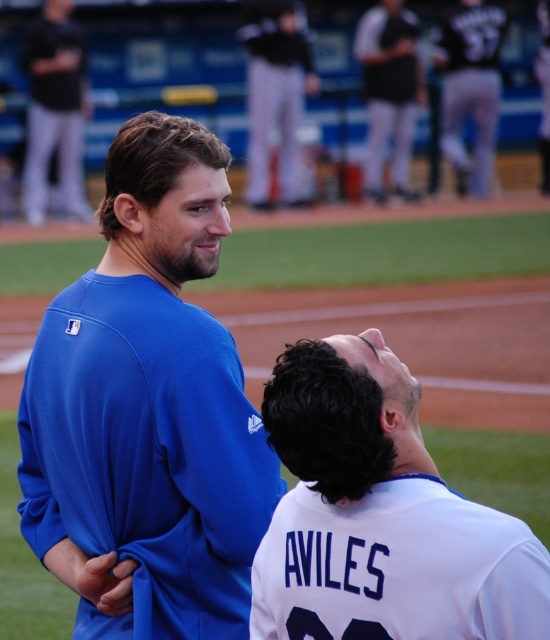
Question: Considering the relative positions of gray pants at upper center and black jersey at upper center in the image provided, where is gray pants at upper center located with respect to black jersey at upper center?

Choices:
 (A) right
 (B) left

Answer: (B)

Question: Estimate the real-world distances between objects in this image. Which object is farther from the matte blue jersey at upper center?

Choices:
 (A) matte blue jersey at center
 (B) black matte pants at upper left
 (C) white jersey at center

Answer: (C)

Question: Is black matte pants at upper left below matte blue jersey at upper center?

Choices:
 (A) no
 (B) yes

Answer: (B)

Question: Which object is positioned farthest from the white jersey at center?

Choices:
 (A) matte blue jersey at center
 (B) black matte pants at upper left
 (C) gray pants at upper center

Answer: (C)

Question: From the image, what is the correct spatial relationship of gray pants at upper center in relation to black jersey at upper center?

Choices:
 (A) left
 (B) right

Answer: (A)

Question: Which point is farther from the camera taking this photo?

Choices:
 (A) (465, 177)
 (B) (541, 19)
 (C) (167, 554)
 (D) (415, 516)

Answer: (B)